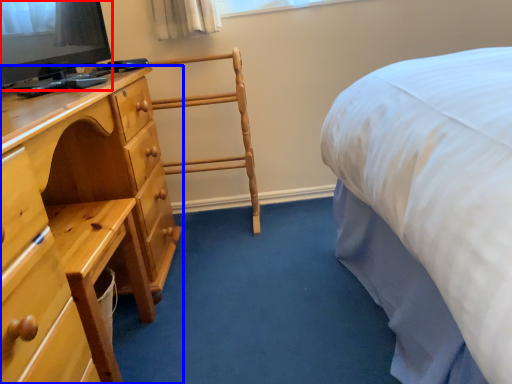
Question: Among these objects, which one is nearest to the camera, television (highlighted by a red box) or chest of drawers (highlighted by a blue box)?

Choices:
 (A) television
 (B) chest of drawers

Answer: (B)